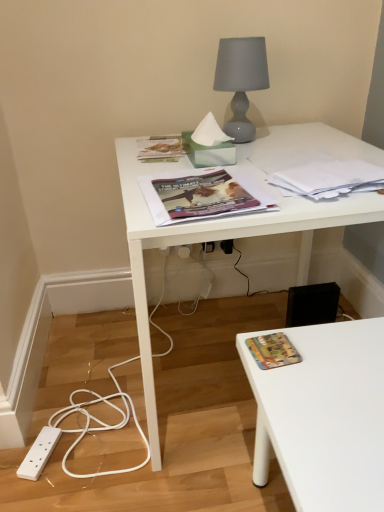
Question: From the image's perspective, does matte gray glass lamp at upper center appear lower than black plastic electric outlet at lower center, which is the 1th electric outlet in right-to-left order?

Choices:
 (A) no
 (B) yes

Answer: (A)

Question: Is the depth of matte gray glass lamp at upper center greater than that of black plastic electric outlet at lower center, which appears as the second electric outlet when viewed from the left?

Choices:
 (A) yes
 (B) no

Answer: (B)

Question: Is matte gray glass lamp at upper center at the right side of black plastic electric outlet at lower center, which is the 1th electric outlet in right-to-left order?

Choices:
 (A) yes
 (B) no

Answer: (A)

Question: Is matte gray glass lamp at upper center touching black plastic electric outlet at lower center, which appears as the second electric outlet when viewed from the left?

Choices:
 (A) yes
 (B) no

Answer: (B)

Question: Does matte gray glass lamp at upper center appear on the left side of black plastic electric outlet at lower center, which is the 1th electric outlet in right-to-left order?

Choices:
 (A) yes
 (B) no

Answer: (B)

Question: Is matte gray glass lamp at upper center surrounding black plastic electric outlet at lower center, which is the 1th electric outlet in right-to-left order?

Choices:
 (A) no
 (B) yes

Answer: (A)

Question: From the image's perspective, does matte green paperback book at upper center, the 1th paperback book viewed from the back, appear lower than matte gray glass lamp at upper center?

Choices:
 (A) no
 (B) yes

Answer: (B)

Question: Is matte green paperback book at upper center, the 2th paperback book viewed from the front, taller than matte gray glass lamp at upper center?

Choices:
 (A) yes
 (B) no

Answer: (B)

Question: Can you confirm if matte green paperback book at upper center, acting as the second paperback book starting from the bottom, is shorter than matte gray glass lamp at upper center?

Choices:
 (A) no
 (B) yes

Answer: (B)

Question: Does matte green paperback book at upper center, the 1th paperback book viewed from the back, lie in front of matte gray glass lamp at upper center?

Choices:
 (A) no
 (B) yes

Answer: (A)

Question: From a real-world perspective, is matte green paperback book at upper center, which appears as the 1th paperback book when viewed from the left, under matte gray glass lamp at upper center?

Choices:
 (A) no
 (B) yes

Answer: (B)

Question: Is matte green paperback book at upper center, the 2th paperback book viewed from the front, at the left side of matte gray glass lamp at upper center?

Choices:
 (A) no
 (B) yes

Answer: (B)

Question: Is white glossy desk at upper center thinner than multicolored fabric book at lower right, which appears as the 1th book cover when ordered from the bottom?

Choices:
 (A) yes
 (B) no

Answer: (B)